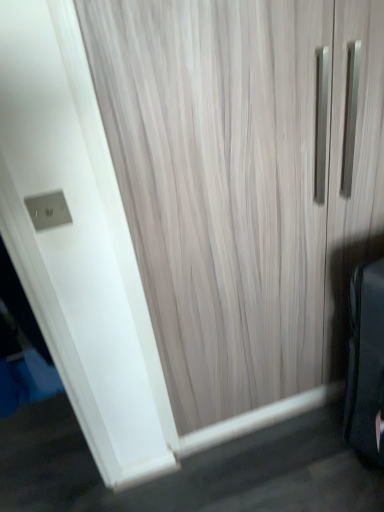
Question: Does satin silver outlet at upper left turn towards wooden door at center?

Choices:
 (A) no
 (B) yes

Answer: (A)

Question: Is satin silver outlet at upper left in front of wooden door at center?

Choices:
 (A) yes
 (B) no

Answer: (B)

Question: From a real-world perspective, is satin silver outlet at upper left beneath wooden door at center?

Choices:
 (A) yes
 (B) no

Answer: (B)

Question: Is satin silver outlet at upper left surrounding wooden door at center?

Choices:
 (A) no
 (B) yes

Answer: (A)

Question: Would you say satin silver outlet at upper left is outside wooden door at center?

Choices:
 (A) yes
 (B) no

Answer: (A)

Question: Can you confirm if satin silver outlet at upper left is positioned to the left of wooden door at center?

Choices:
 (A) yes
 (B) no

Answer: (A)

Question: Is wooden door at center facing towards satin silver outlet at upper left?

Choices:
 (A) yes
 (B) no

Answer: (B)

Question: Is the depth of wooden door at center greater than that of satin silver outlet at upper left?

Choices:
 (A) no
 (B) yes

Answer: (A)

Question: Is wooden door at center facing away from satin silver outlet at upper left?

Choices:
 (A) yes
 (B) no

Answer: (B)

Question: Can you confirm if wooden door at center is taller than satin silver outlet at upper left?

Choices:
 (A) no
 (B) yes

Answer: (B)

Question: From the image's perspective, does wooden door at center appear higher than satin silver outlet at upper left?

Choices:
 (A) yes
 (B) no

Answer: (B)

Question: Does wooden door at center appear on the left side of satin silver outlet at upper left?

Choices:
 (A) no
 (B) yes

Answer: (A)

Question: Considering their positions, is satin silver outlet at upper left located in front of or behind wooden door at center?

Choices:
 (A) behind
 (B) front

Answer: (A)